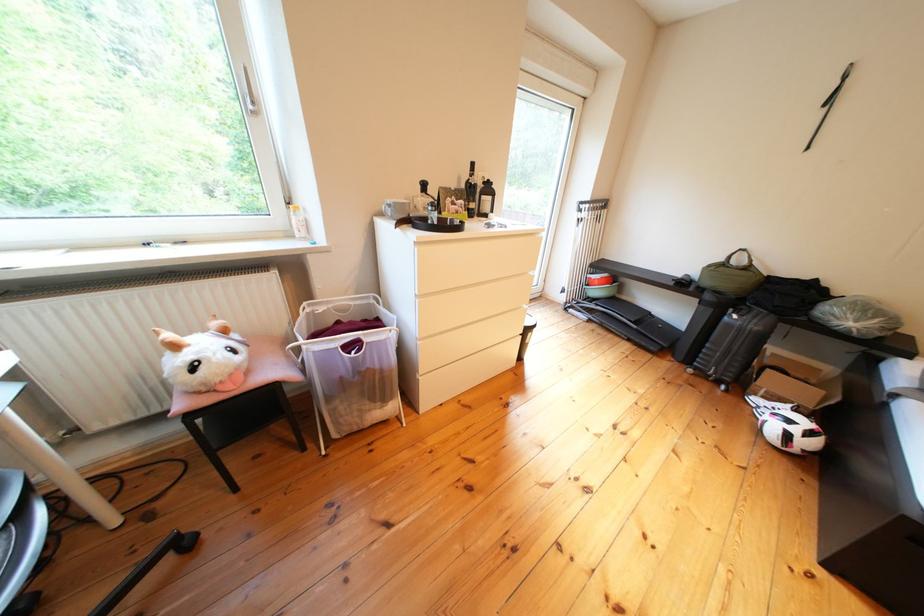
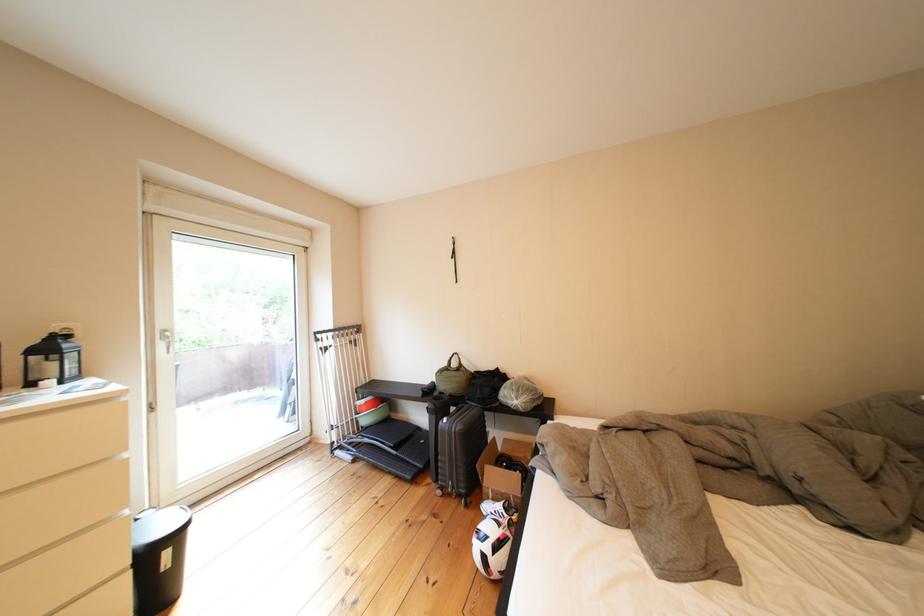
Where in the second image is the point corresponding to (x=801, y=440) from the first image?

(499, 562)